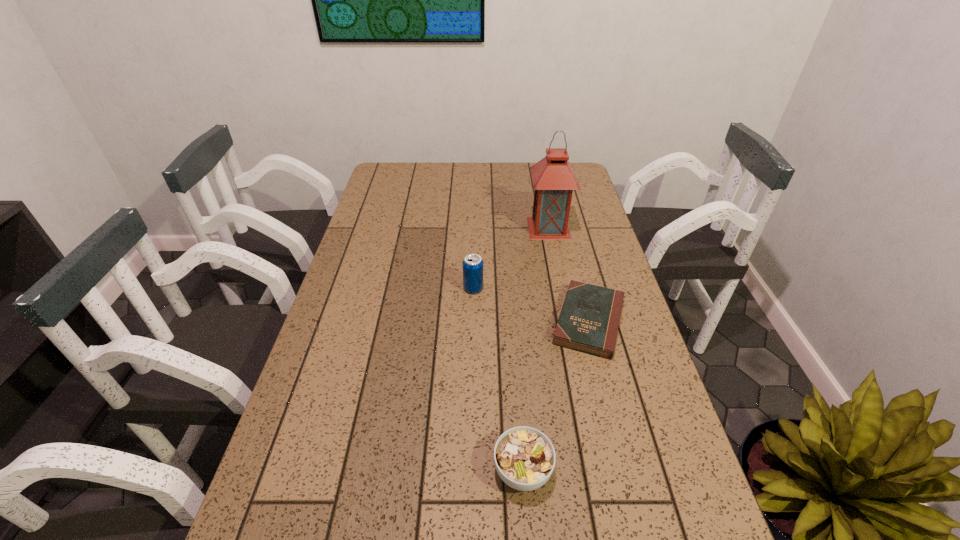
Find the location of a particular element. The width and height of the screenshot is (960, 540). vacant region located on the front of the Bible is located at coordinates (627, 469).

This screenshot has height=540, width=960. Identify the location of lantern that is at the right edge. (554, 179).

Locate an element on the screen. The width and height of the screenshot is (960, 540). Bible located in the right edge section of the desktop is located at coordinates (589, 320).

Locate an element on the screen. vacant region at the far edge of the desktop is located at coordinates (488, 188).

Where is `free space at the left edge`? The width and height of the screenshot is (960, 540). free space at the left edge is located at coordinates (364, 320).

This screenshot has height=540, width=960. In the image, there is a desktop. In order to click on free space at the right edge in this screenshot , I will do `click(666, 509)`.

Where is `free space between the leftmost object and the shortest object`? The image size is (960, 540). free space between the leftmost object and the shortest object is located at coordinates (531, 305).

Locate an element on the screen. free spot between the leftmost object and the farthest object is located at coordinates (511, 258).

The width and height of the screenshot is (960, 540). Identify the location of free area in between the Bible and the tallest object. (568, 275).

The width and height of the screenshot is (960, 540). I want to click on vacant area that lies between the second object from left to right and the third shortest object, so click(498, 380).